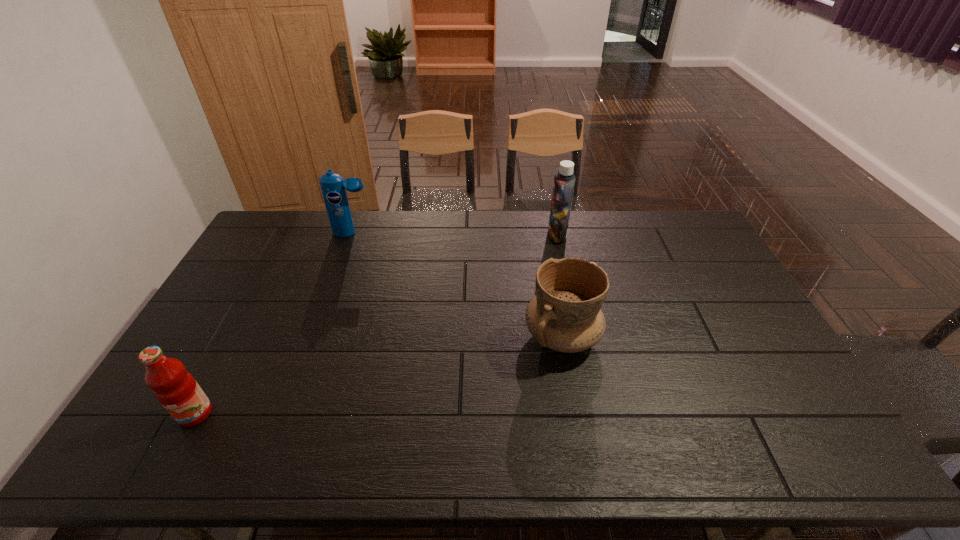
The width and height of the screenshot is (960, 540). What are the coordinates of `free space between the fruit juice and the right shampoo` in the screenshot? It's located at (376, 324).

The image size is (960, 540). I want to click on free space between the left shampoo and the pottery, so click(x=457, y=285).

Where is `vacant area that lies between the fruit juice and the right shampoo`? The image size is (960, 540). vacant area that lies between the fruit juice and the right shampoo is located at coordinates (376, 324).

This screenshot has width=960, height=540. Identify the location of empty space that is in between the left shampoo and the leftmost object. (274, 323).

Image resolution: width=960 pixels, height=540 pixels. In order to click on vacant area that lies between the second object from left to right and the right shampoo in this screenshot , I will do `click(455, 234)`.

Identify the location of vacant area that lies between the pottery and the second object from left to right. This screenshot has width=960, height=540. (457, 285).

Where is `free point between the third object from right to left and the fruit juice`? This screenshot has width=960, height=540. free point between the third object from right to left and the fruit juice is located at coordinates (274, 323).

Locate an element on the screen. This screenshot has width=960, height=540. free space between the third object from right to left and the pottery is located at coordinates (457, 285).

The height and width of the screenshot is (540, 960). Identify the location of object that is the second closest one to the nearest object. (565, 315).

Locate an element on the screen. The width and height of the screenshot is (960, 540). object that is the second closest one to the pottery is located at coordinates (333, 187).